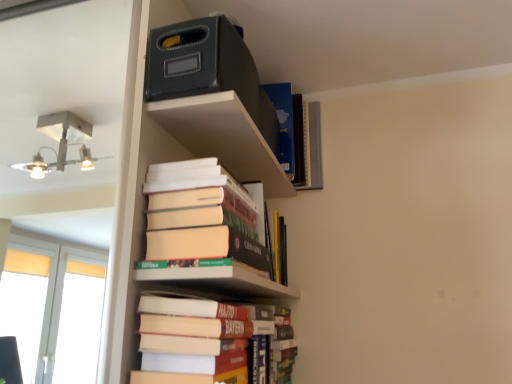
Question: Is point click(160, 312) closer or farther from the camera than point click(210, 231)?

Choices:
 (A) closer
 (B) farther

Answer: (A)

Question: Considering the positions of hardcover books at lower center, the 3th book positioned from the top, and hardcover books at center, the 2th book positioned from the top, in the image, is hardcover books at lower center, the 3th book positioned from the top, taller or shorter than hardcover books at center, the 2th book positioned from the top,?

Choices:
 (A) short
 (B) tall

Answer: (A)

Question: Considering the real-world distances, which object is farthest from the hardcover book at center?

Choices:
 (A) hardcover book at upper center, marked as the third book in a bottom-to-top arrangement
 (B) hardcover books at center, the 2th book positioned from the top
 (C) hardcover books at lower center, which is counted as the 1th book, starting from the bottom

Answer: (A)

Question: Based on their relative distances, which object is nearer to the hardcover book at center?

Choices:
 (A) hardcover books at center, the 2th book positioned from the top
 (B) hardcover book at upper center, the 1th book positioned from the top
 (C) hardcover books at lower center, which is counted as the 1th book, starting from the bottom

Answer: (C)